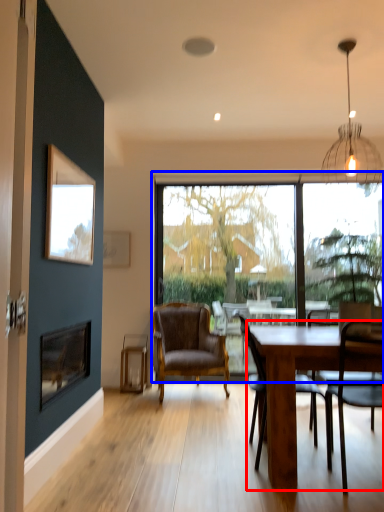
Question: Which object is further to the camera taking this photo, round table (highlighted by a red box) or window (highlighted by a blue box)?

Choices:
 (A) round table
 (B) window

Answer: (B)